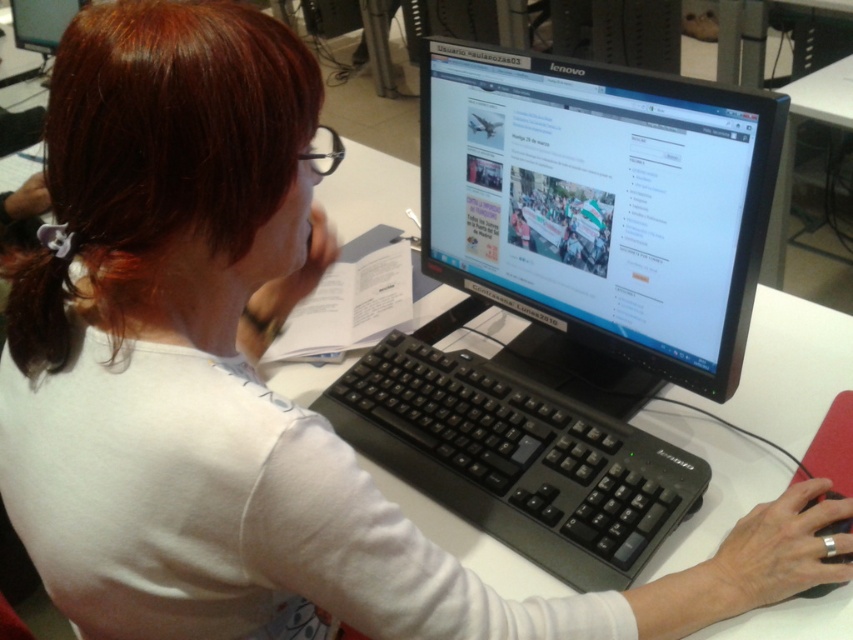
You are standing at the point marked as point (33, 44) and want to move to the point marked as point (607, 456). Based on the scene description, which direction should you move to reach your destination?

You should move forward because point (607, 456) is in front of point (33, 44).

You are a delivery person who needs to place a new keyboard on the desk without moving the existing black plastic keyboard at center. The new keyboard is 12 inches long. Can you fit it horizontally next to the existing keyboard on the desk?

The distance between the black plastic keyboard at center and the viewer is 31.27 inches. Since the new keyboard is 12 inches long, it can be placed horizontally next to the existing black plastic keyboard at center as there is sufficient space along the desk surface.